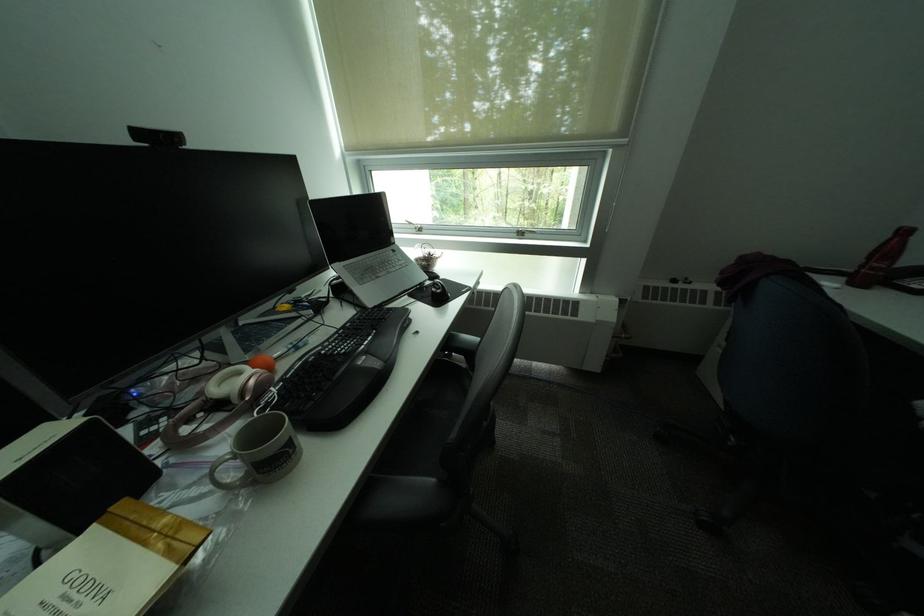
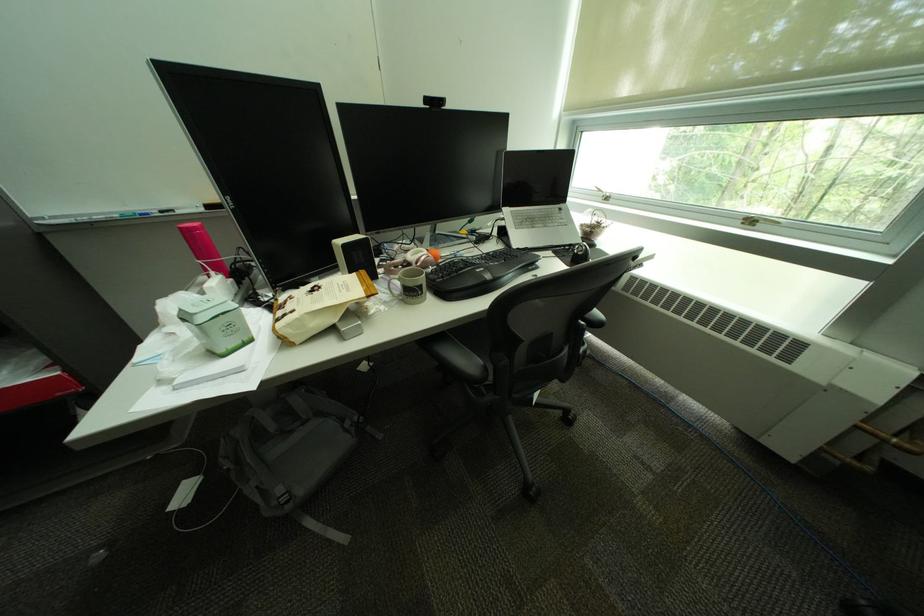
The point at (432, 285) is marked in the first image. Where is the corresponding point in the second image?

(580, 246)